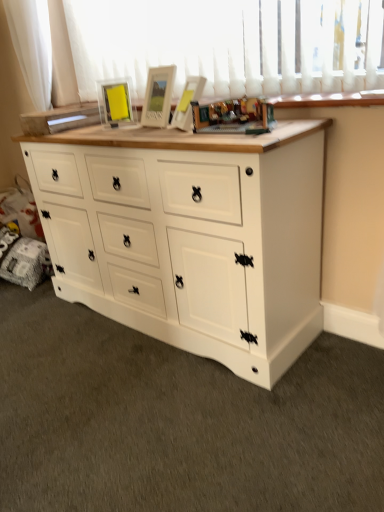
Question: Can you confirm if wooden toy at center is shorter than white fabric curtain at upper left?

Choices:
 (A) yes
 (B) no

Answer: (A)

Question: Does wooden toy at center have a larger size compared to white fabric curtain at upper left?

Choices:
 (A) yes
 (B) no

Answer: (B)

Question: Is wooden toy at center at the left side of white fabric curtain at upper left?

Choices:
 (A) no
 (B) yes

Answer: (A)

Question: Is wooden toy at center positioned with its back to white fabric curtain at upper left?

Choices:
 (A) no
 (B) yes

Answer: (A)

Question: Would you say wooden toy at center is outside white fabric curtain at upper left?

Choices:
 (A) no
 (B) yes

Answer: (B)

Question: Are wooden toy at center and white fabric curtain at upper left beside each other?

Choices:
 (A) yes
 (B) no

Answer: (B)

Question: Considering the relative sizes of wooden toy at center and matte glass picture frame at upper center in the image provided, is wooden toy at center bigger than matte glass picture frame at upper center?

Choices:
 (A) no
 (B) yes

Answer: (B)

Question: Is wooden toy at center further to camera compared to matte glass picture frame at upper center?

Choices:
 (A) no
 (B) yes

Answer: (A)

Question: From the image's perspective, is wooden toy at center on matte glass picture frame at upper center?

Choices:
 (A) no
 (B) yes

Answer: (A)

Question: From a real-world perspective, is wooden toy at center positioned under matte glass picture frame at upper center based on gravity?

Choices:
 (A) yes
 (B) no

Answer: (A)

Question: Considering the relative positions of wooden toy at center and matte glass picture frame at upper center in the image provided, is wooden toy at center to the left of matte glass picture frame at upper center from the viewer's perspective?

Choices:
 (A) no
 (B) yes

Answer: (A)

Question: Is matte glass picture frame at upper center a part of wooden toy at center?

Choices:
 (A) no
 (B) yes

Answer: (A)

Question: Is white fabric curtain at upper left not near white painted wood chest of drawers at center?

Choices:
 (A) yes
 (B) no

Answer: (A)